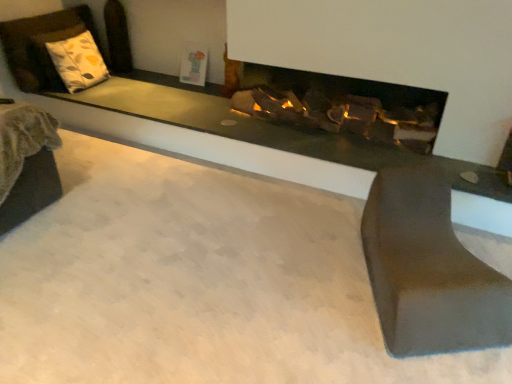
Question: Is white fabric pillow at upper left taller or shorter than matte gray bench at lower right?

Choices:
 (A) tall
 (B) short

Answer: (A)

Question: Is white fabric pillow at upper left inside or outside of matte gray bench at lower right?

Choices:
 (A) outside
 (B) inside

Answer: (A)

Question: In the image, is white fabric pillow at upper left positioned in front of or behind matte gray bench at lower right?

Choices:
 (A) behind
 (B) front

Answer: (A)

Question: Is matte gray bench at lower right wider or thinner than white fabric pillow at upper left?

Choices:
 (A) thin
 (B) wide

Answer: (B)

Question: From their relative heights in the image, would you say matte gray bench at lower right is taller or shorter than white fabric pillow at upper left?

Choices:
 (A) tall
 (B) short

Answer: (B)

Question: Is point (478, 347) positioned closer to the camera than point (103, 72)?

Choices:
 (A) closer
 (B) farther

Answer: (A)

Question: In the image, is matte gray bench at lower right positioned in front of or behind white fabric pillow at upper left?

Choices:
 (A) behind
 (B) front

Answer: (B)